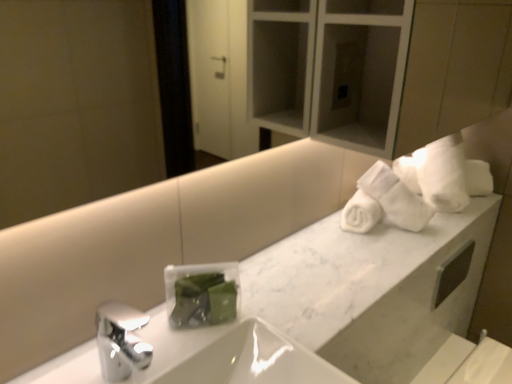
What do you see at coordinates (230, 355) in the screenshot?
I see `white glossy sink at center` at bounding box center [230, 355].

At what (x,y) coordinates should I click in order to perform the action: click on white marble counter at upper right. Please return your answer as a coordinate pair (x, y). Image resolution: width=512 pixels, height=384 pixels. Looking at the image, I should click on (370, 290).

Describe the element at coordinates (414, 188) in the screenshot. Image resolution: width=512 pixels, height=384 pixels. I see `white soft towels at upper right` at that location.

I want to click on white glossy sink at center, so click(x=230, y=355).

From a real-world perspective, between white glossy sink at center and white marble counter at upper right, who is vertically higher?

white marble counter at upper right.

In the scene shown: Considering the sizes of objects white glossy sink at center and white marble counter at upper right in the image provided, who is thinner, white glossy sink at center or white marble counter at upper right?

Thinner between the two is white marble counter at upper right.

Is point (254, 337) closer to viewer compared to point (295, 320)?

Yes, point (254, 337) is closer to viewer.

In the scene shown: Would you say white glossy sink at center contains white marble counter at upper right?

No.

Is white marble counter at upper right smaller than white glossy sink at center?

Correct, white marble counter at upper right occupies less space than white glossy sink at center.

Is white marble counter at upper right at the right side of white glossy sink at center?

Correct, you'll find white marble counter at upper right to the right of white glossy sink at center.

From a real-world perspective, which is physically below, white marble counter at upper right or white glossy sink at center?

In real-world perspective, white glossy sink at center is lower.

How far apart are white marble counter at upper right and white glossy sink at center?

A distance of 27.44 centimeters exists between white marble counter at upper right and white glossy sink at center.

From the image's perspective, is white marble counter at upper right positioned above or below white soft towels at upper right?

white marble counter at upper right is below white soft towels at upper right.

Is white soft towels at upper right inside white marble counter at upper right?

No, white soft towels at upper right is not inside white marble counter at upper right.

Find the location of a particular element. bath towel that is above the white marble counter at upper right (from a real-world perspective) is located at coordinates (414, 188).

Is white marble counter at upper right in front of or behind white soft towels at upper right in the image?

Clearly, white marble counter at upper right is in front of white soft towels at upper right.

Is white soft towels at upper right far from white glossy sink at center?

Actually, white soft towels at upper right and white glossy sink at center are a little close together.

From the picture: Relative to white glossy sink at center, is white soft towels at upper right in front or behind?

Visually, white soft towels at upper right is located behind white glossy sink at center.

Is white glossy sink at center surrounded by white soft towels at upper right?

Definitely not — white glossy sink at center is not inside white soft towels at upper right.

This screenshot has height=384, width=512. I want to click on bath towel on the right of white glossy sink at center, so click(x=414, y=188).

Does white glossy sink at center contain white soft towels at upper right?

No, white soft towels at upper right is not inside white glossy sink at center.

From a real-world perspective, is white glossy sink at center under white soft towels at upper right?

Yes, from a real-world perspective, white glossy sink at center is beneath white soft towels at upper right.

Who is shorter, white glossy sink at center or white soft towels at upper right?

white glossy sink at center is shorter.

Is the surface of white glossy sink at center in direct contact with white soft towels at upper right?

No, white glossy sink at center is not beside white soft towels at upper right.

From a real-world perspective, relative to white marble counter at upper right, is white soft towels at upper right vertically above or below?

white soft towels at upper right is above white marble counter at upper right.

I want to click on counter in front of the white soft towels at upper right, so click(370, 290).

Between white soft towels at upper right and white marble counter at upper right, which one appears on the right side from the viewer's perspective?

white soft towels at upper right.

Does point (397, 221) come farther from viewer compared to point (374, 286)?

Yes, point (397, 221) is farther from viewer.

Locate an element on the screen. sink lying on the left of white marble counter at upper right is located at coordinates (230, 355).

Image resolution: width=512 pixels, height=384 pixels. What are the coordinates of `counter above the white glossy sink at center (from the image's perspective)` in the screenshot? It's located at (370, 290).

When comparing their distances from white soft towels at upper right, does white marble counter at upper right or white glossy sink at center seem closer?

Among the two, white marble counter at upper right is located nearer to white soft towels at upper right.

Estimate the real-world distances between objects in this image. Which object is closer to white glossy sink at center, white soft towels at upper right or white marble counter at upper right?

white marble counter at upper right is positioned closer to the anchor white glossy sink at center.

When comparing their distances from white marble counter at upper right, does white soft towels at upper right or white glossy sink at center seem closer?

white soft towels at upper right is closer to white marble counter at upper right.

When comparing their distances from white marble counter at upper right, does white glossy sink at center or white soft towels at upper right seem further?

The object further to white marble counter at upper right is white glossy sink at center.

Looking at the image, which one is located closer to white soft towels at upper right, white glossy sink at center or white marble counter at upper right?

white marble counter at upper right.

Looking at the image, which one is located further to white glossy sink at center, white marble counter at upper right or white soft towels at upper right?

The object further to white glossy sink at center is white soft towels at upper right.

In order to click on counter between white glossy sink at center and white soft towels at upper right from front to back in this screenshot , I will do `click(370, 290)`.